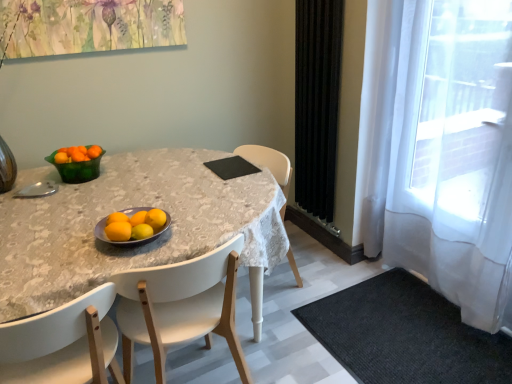
Question: Which direction should I rotate to look at orange matte at center, acting as the 1th tangerine starting from the front, — up or down?

Choices:
 (A) down
 (B) up

Answer: (A)

Question: From the image's perspective, would you say white plastic chair at lower center, the first chair in the left-to-right sequence, is positioned over black matte pad at center?

Choices:
 (A) no
 (B) yes

Answer: (A)

Question: Can you confirm if white plastic chair at lower center, the first chair in the left-to-right sequence, is wider than black matte pad at center?

Choices:
 (A) no
 (B) yes

Answer: (B)

Question: Does white plastic chair at lower center, which is the 2th chair in right-to-left order, have a lesser height compared to black matte pad at center?

Choices:
 (A) no
 (B) yes

Answer: (A)

Question: Is white plastic chair at lower center, which is the 2th chair in right-to-left order, positioned in front of black matte pad at center?

Choices:
 (A) no
 (B) yes

Answer: (B)

Question: From the image's perspective, is white plastic chair at lower center, the first chair in the left-to-right sequence, below black matte pad at center?

Choices:
 (A) yes
 (B) no

Answer: (A)

Question: Is white plastic chair at lower center, which is the 2th chair in right-to-left order, to the right of black matte pad at center from the viewer's perspective?

Choices:
 (A) no
 (B) yes

Answer: (A)

Question: Is black matte pad at center located within orangesmoothfruit at center, marked as the third orange in a front-to-back arrangement?

Choices:
 (A) yes
 (B) no

Answer: (B)

Question: Is orangesmoothfruit at center, marked as the third orange in a front-to-back arrangement, smaller than black matte pad at center?

Choices:
 (A) no
 (B) yes

Answer: (B)

Question: Is orangesmoothfruit at center, which appears as the 1th orange when viewed from the back, at the left side of black matte pad at center?

Choices:
 (A) yes
 (B) no

Answer: (A)

Question: From the image's perspective, would you say orangesmoothfruit at center, marked as the third orange in a front-to-back arrangement, is shown under black matte pad at center?

Choices:
 (A) no
 (B) yes

Answer: (B)

Question: From a real-world perspective, does orangesmoothfruit at center, which appears as the 1th orange when viewed from the back, stand above black matte pad at center?

Choices:
 (A) no
 (B) yes

Answer: (B)

Question: Is orangesmoothfruit at center, marked as the third orange in a front-to-back arrangement, in contact with black matte pad at center?

Choices:
 (A) no
 (B) yes

Answer: (A)

Question: Is black matte pad at center next to orange matte at center, the second tangerine when ordered from bottom to top, and touching it?

Choices:
 (A) no
 (B) yes

Answer: (A)